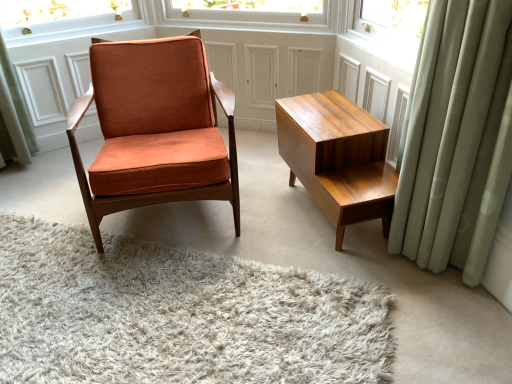
Question: Is wooden table at right facing away from white shag rug at center?

Choices:
 (A) no
 (B) yes

Answer: (A)

Question: From the image's perspective, is wooden table at right located beneath white shag rug at center?

Choices:
 (A) yes
 (B) no

Answer: (B)

Question: Does wooden table at right appear on the right side of white shag rug at center?

Choices:
 (A) no
 (B) yes

Answer: (B)

Question: Is the depth of wooden table at right greater than that of white shag rug at center?

Choices:
 (A) no
 (B) yes

Answer: (B)

Question: From a real-world perspective, is wooden table at right beneath white shag rug at center?

Choices:
 (A) yes
 (B) no

Answer: (B)

Question: From their relative heights in the image, would you say wooden table at right is taller or shorter than orange velvet chair at center?

Choices:
 (A) tall
 (B) short

Answer: (B)

Question: Considering their positions, is wooden table at right located in front of or behind orange velvet chair at center?

Choices:
 (A) front
 (B) behind

Answer: (B)

Question: From the image's perspective, relative to orange velvet chair at center, is wooden table at right above or below?

Choices:
 (A) below
 (B) above

Answer: (A)

Question: Would you say wooden table at right is inside or outside orange velvet chair at center?

Choices:
 (A) outside
 (B) inside

Answer: (A)

Question: Relative to light green fabric curtain at right, is wooden table at right in front or behind?

Choices:
 (A) behind
 (B) front

Answer: (A)

Question: From the image's perspective, is wooden table at right above or below light green fabric curtain at right?

Choices:
 (A) below
 (B) above

Answer: (A)

Question: Does point (335, 231) appear closer or farther from the camera than point (464, 56)?

Choices:
 (A) farther
 (B) closer

Answer: (A)

Question: Do you think wooden table at right is within light green fabric curtain at right, or outside of it?

Choices:
 (A) outside
 (B) inside

Answer: (A)

Question: Considering the positions of light green fabric curtain at right and white shag rug at center in the image, is light green fabric curtain at right bigger or smaller than white shag rug at center?

Choices:
 (A) big
 (B) small

Answer: (A)

Question: Which is correct: light green fabric curtain at right is inside white shag rug at center, or outside of it?

Choices:
 (A) outside
 (B) inside

Answer: (A)